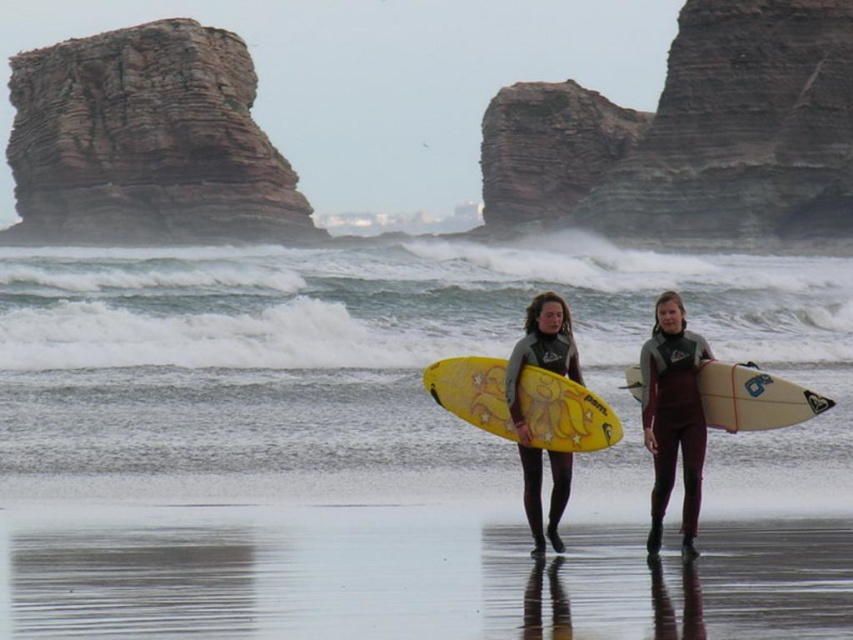
Question: Can you confirm if gray matte wetsuit at center is positioned to the right of yellow matte surfboard at center?

Choices:
 (A) no
 (B) yes

Answer: (B)

Question: Is brown rough rock at upper center wider than maroon neoprene wetsuit at center?

Choices:
 (A) no
 (B) yes

Answer: (B)

Question: Which is nearer to the rusty stone rock at upper left?

Choices:
 (A) brown rough rock at upper center
 (B) white glossy surfboard at center

Answer: (A)

Question: Can you confirm if brown rough rock at upper center is bigger than white glossy surfboard at center?

Choices:
 (A) no
 (B) yes

Answer: (B)

Question: Which point is farther from the camera taking this photo?

Choices:
 (A) (699, 419)
 (B) (703, 403)

Answer: (B)

Question: Estimate the real-world distances between objects in this image. Which object is farther from the brown rough rock at upper center?

Choices:
 (A) matte black wetsuit at center
 (B) yellow matte surfboard at center
 (C) rusty stone rock at upper left
 (D) white glossy surfboard at center

Answer: (B)